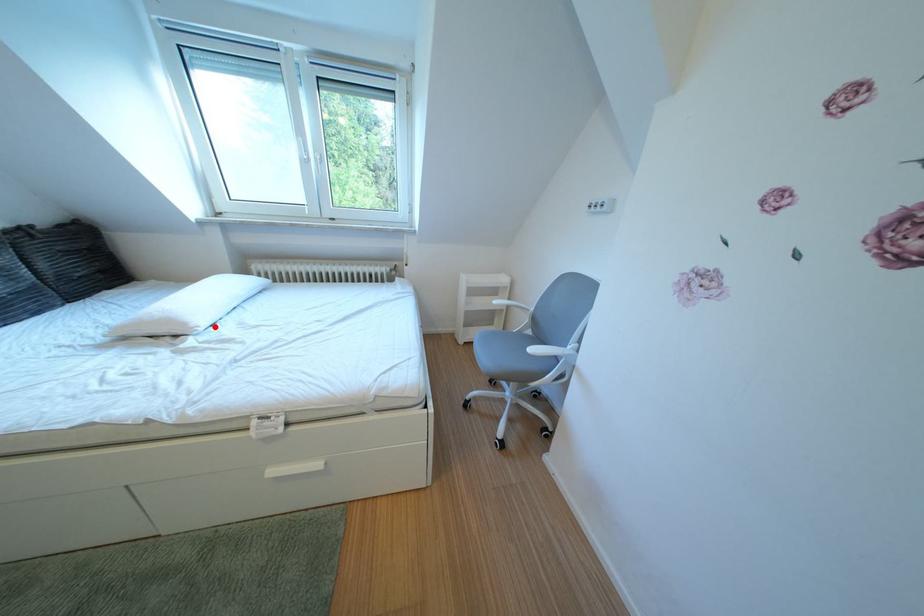
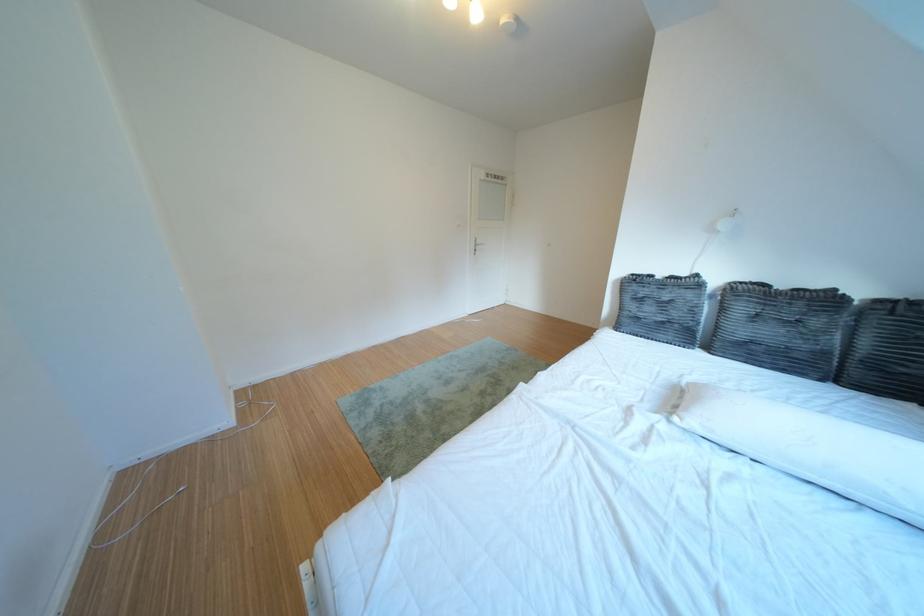
In the second image, find the point that corresponds to the highlighted location in the first image.

(707, 424)